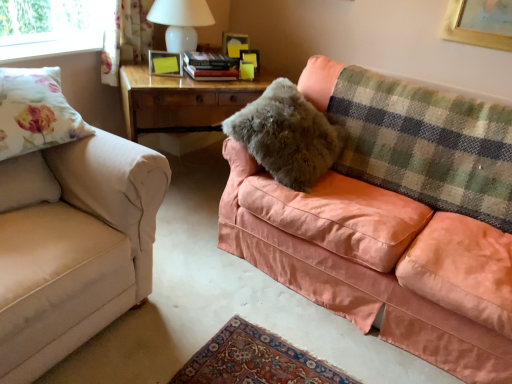
Where is `vacant area that is in front of wooden table at center`? vacant area that is in front of wooden table at center is located at coordinates (195, 237).